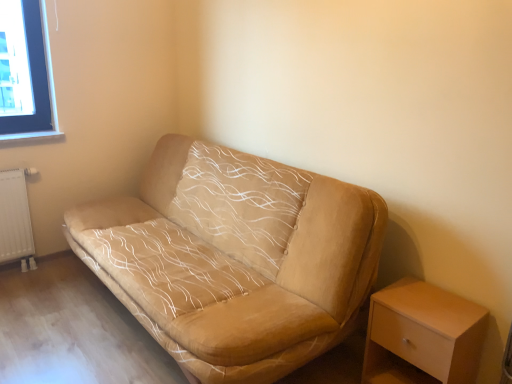
Question: Does white textured radiator at lower left come in front of beige fabric couch at center?

Choices:
 (A) yes
 (B) no

Answer: (B)

Question: Could you tell me if white textured radiator at lower left is turned towards beige fabric couch at center?

Choices:
 (A) yes
 (B) no

Answer: (B)

Question: From a real-world perspective, is white textured radiator at lower left positioned over beige fabric couch at center based on gravity?

Choices:
 (A) yes
 (B) no

Answer: (B)

Question: Does white textured radiator at lower left lie behind beige fabric couch at center?

Choices:
 (A) yes
 (B) no

Answer: (A)

Question: Is white textured radiator at lower left located outside beige fabric couch at center?

Choices:
 (A) no
 (B) yes

Answer: (B)

Question: Can you confirm if white textured radiator at lower left is thinner than beige fabric couch at center?

Choices:
 (A) yes
 (B) no

Answer: (A)

Question: Would you say white matte wooden table at lower right is outside white textured radiator at lower left?

Choices:
 (A) yes
 (B) no

Answer: (A)

Question: Can you confirm if white matte wooden table at lower right is thinner than white textured radiator at lower left?

Choices:
 (A) no
 (B) yes

Answer: (A)

Question: Does white matte wooden table at lower right lie behind white textured radiator at lower left?

Choices:
 (A) no
 (B) yes

Answer: (A)

Question: Could you tell me if white matte wooden table at lower right is facing white textured radiator at lower left?

Choices:
 (A) no
 (B) yes

Answer: (A)

Question: Is white matte wooden table at lower right in front of white textured radiator at lower left?

Choices:
 (A) no
 (B) yes

Answer: (B)

Question: Is white matte wooden table at lower right to the right of white textured radiator at lower left from the viewer's perspective?

Choices:
 (A) yes
 (B) no

Answer: (A)

Question: From a real-world perspective, does beige fabric couch at center stand above white matte wooden table at lower right?

Choices:
 (A) yes
 (B) no

Answer: (A)